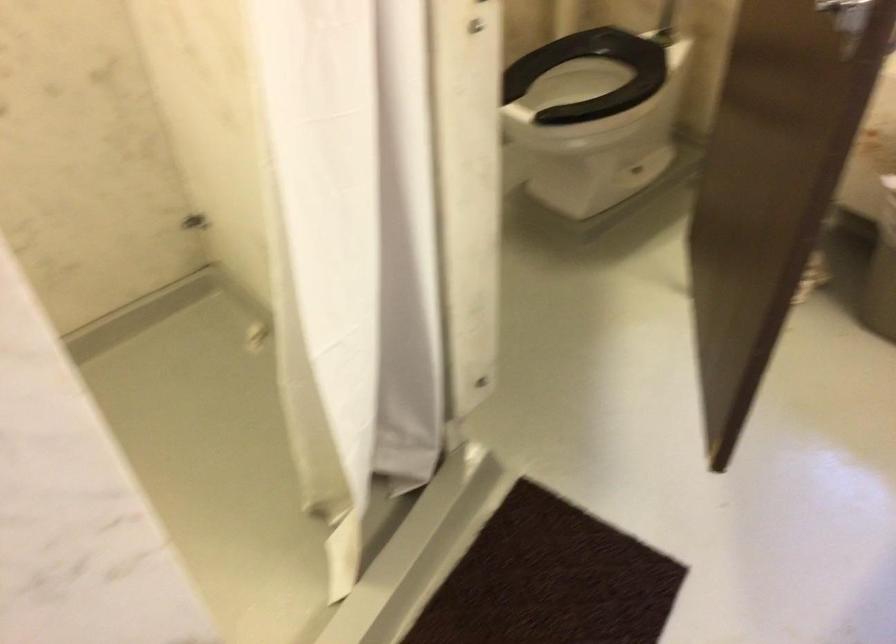
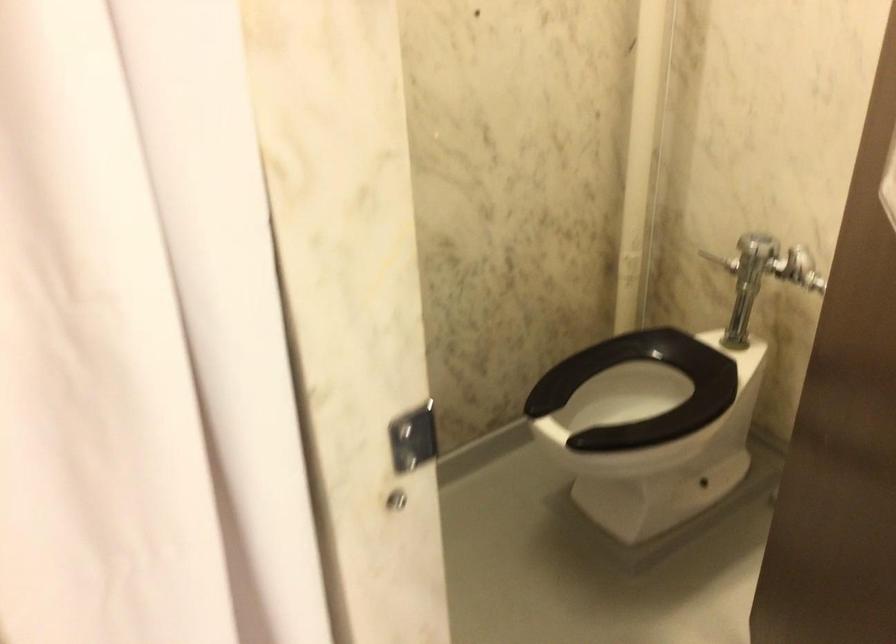
Question: Based on the continuous images, in which direction is the camera rotating? Reply with the corresponding letter.

Choices:
 (A) Left
 (B) Right
 (C) Up
 (D) Down

Answer: (C)